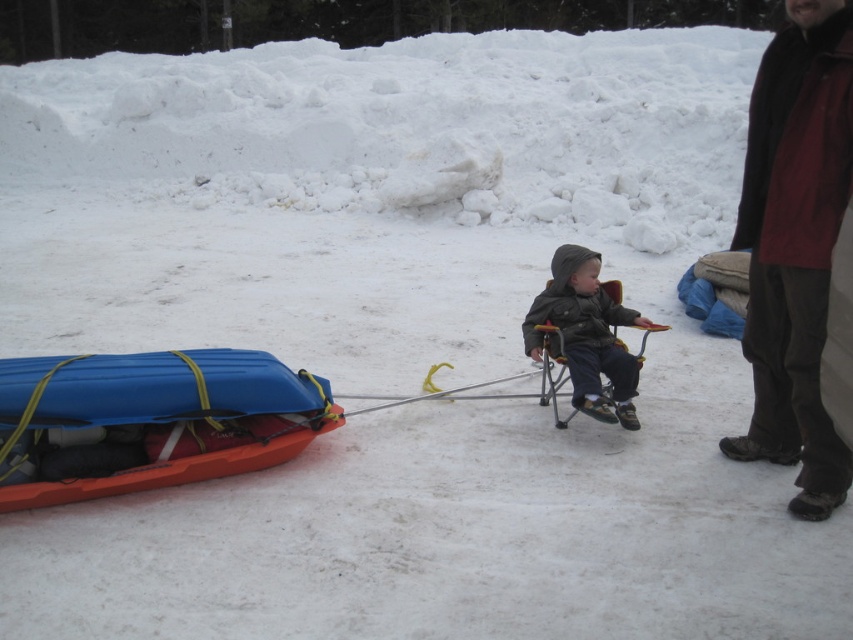
You are a delivery person trying to place a package between the dark brown leather jacket at right and the blue plastic kayak at lower left. Based on the scene, can you fit the package there?

The dark brown leather jacket at right is to the right of the blue plastic kayak at lower left, so there is space between them to place the package.

You are a delivery person who needs to place a package between the dark brown leather jacket at right and the dark gray fabric jacket at center. The package is 30 inches long. Can you fit it between them?

The distance between the dark brown leather jacket at right and the dark gray fabric jacket at center is 32.68 inches, so the 30 inches long package can fit between them since it is shorter than the available space.